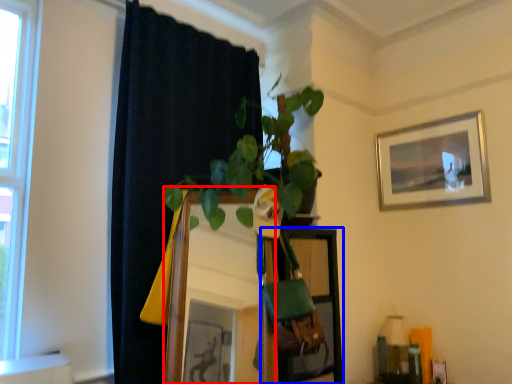
Question: Which object is closer to the camera taking this photo, mirror (highlighted by a red box) or shelf (highlighted by a blue box)?

Choices:
 (A) mirror
 (B) shelf

Answer: (A)